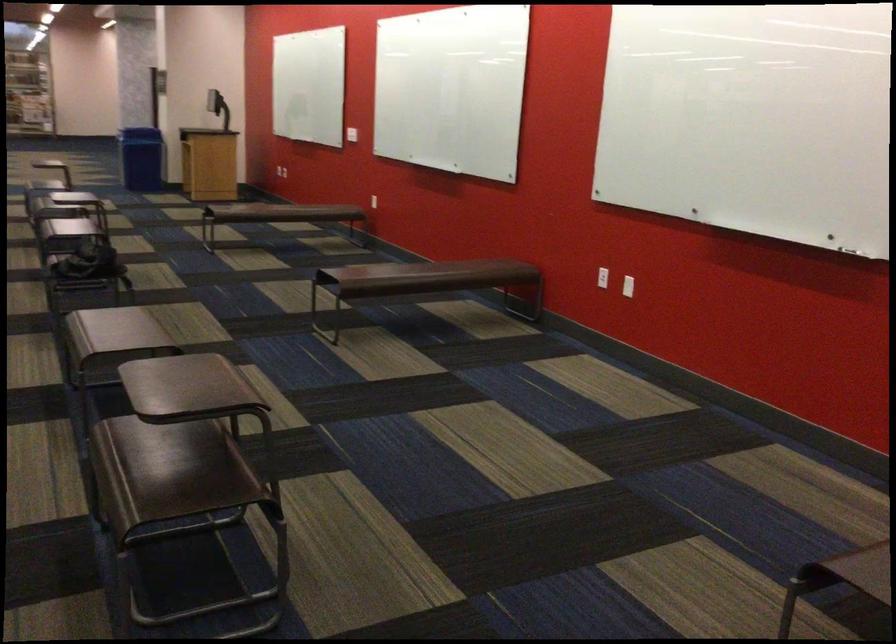
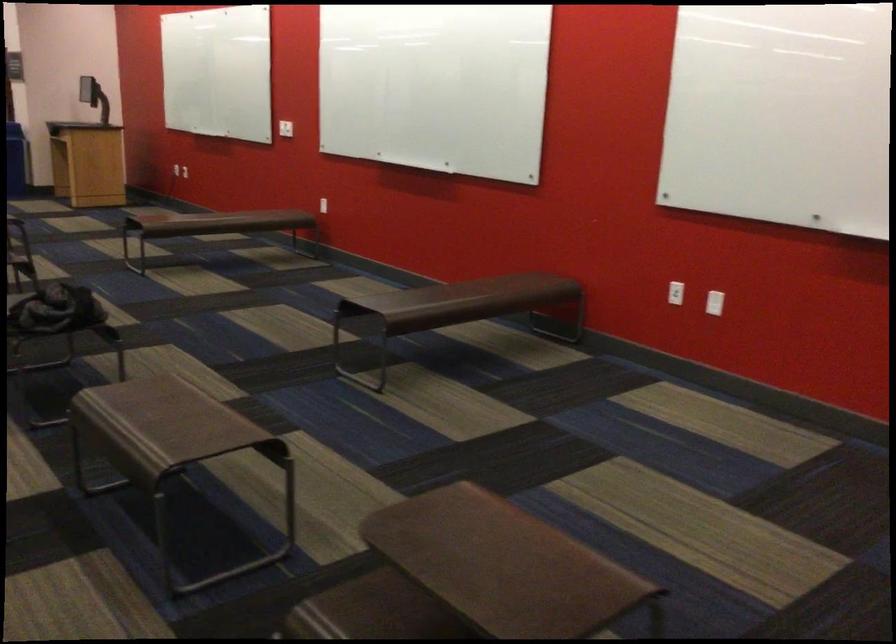
Locate, in the second image, the point that corresponds to point 179,397 in the first image.

(498, 564)